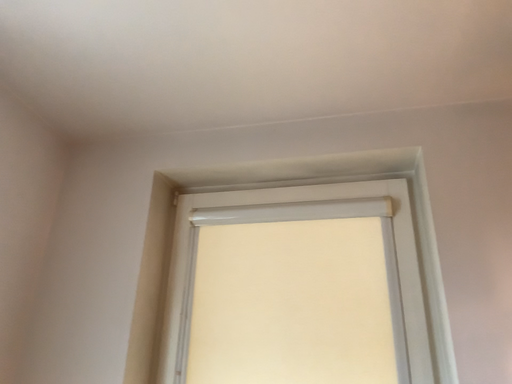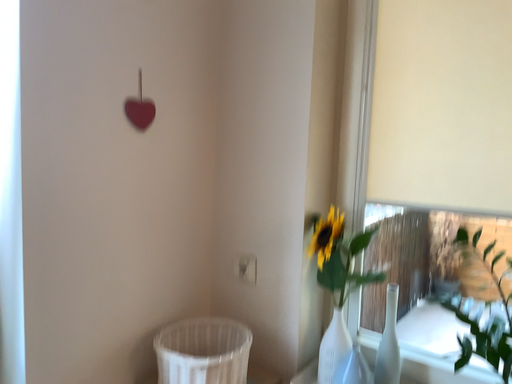
Question: Which way did the camera rotate in the video?

Choices:
 (A) rotated right
 (B) rotated left

Answer: (B)